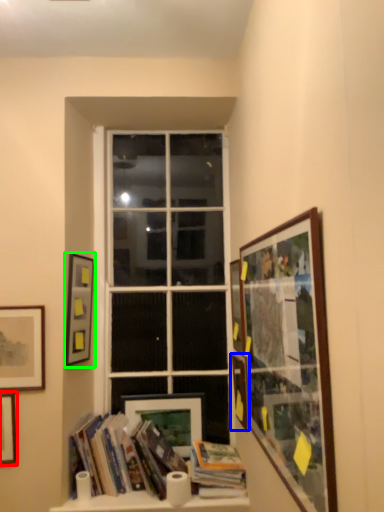
Question: Which object is positioned closest to picture frame (highlighted by a red box)? Select from picture frame (highlighted by a blue box) and picture frame (highlighted by a green box).

Choices:
 (A) picture frame
 (B) picture frame

Answer: (B)